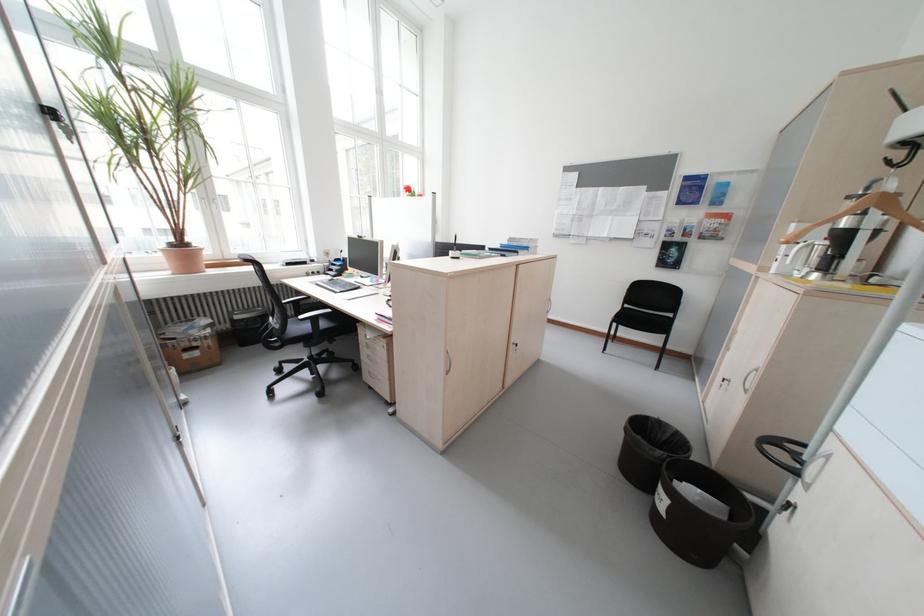
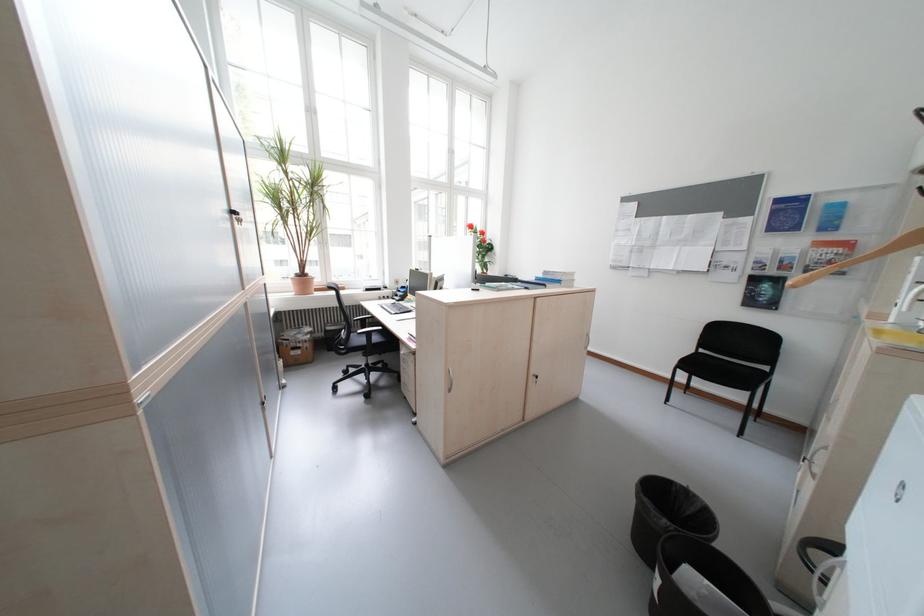
In the second image, find the point that corresponds to point (452, 370) in the first image.

(453, 387)